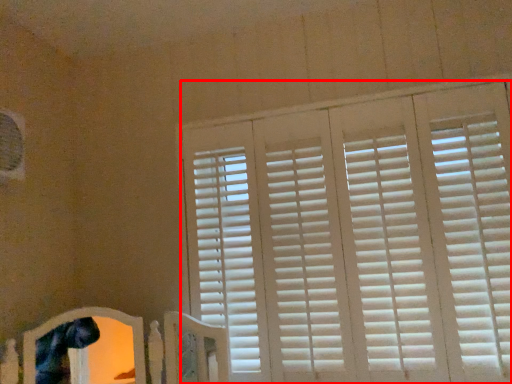
Question: From the image's perspective, what is the correct spatial positioning of window blind (annotated by the red box) in reference to bed frame?

Choices:
 (A) below
 (B) above

Answer: (B)